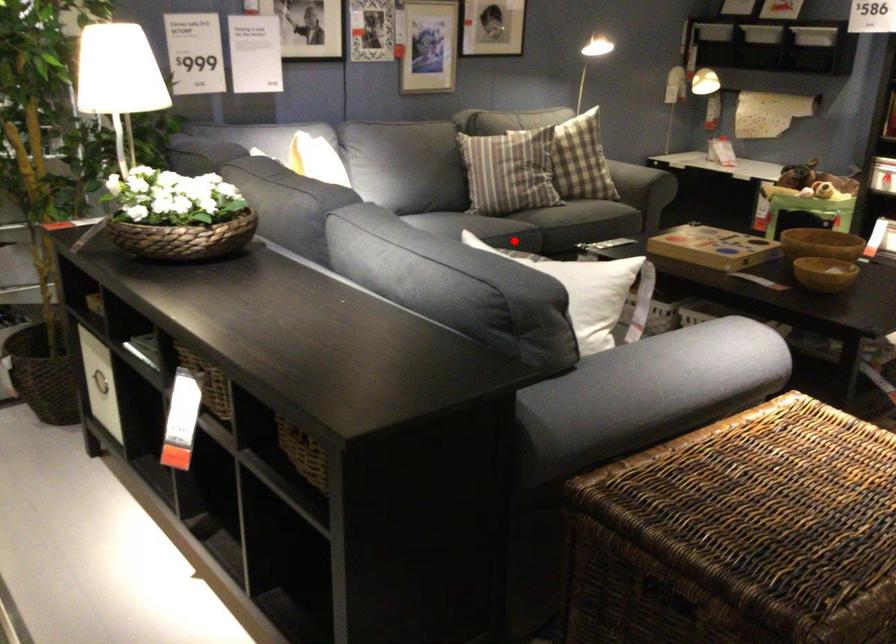
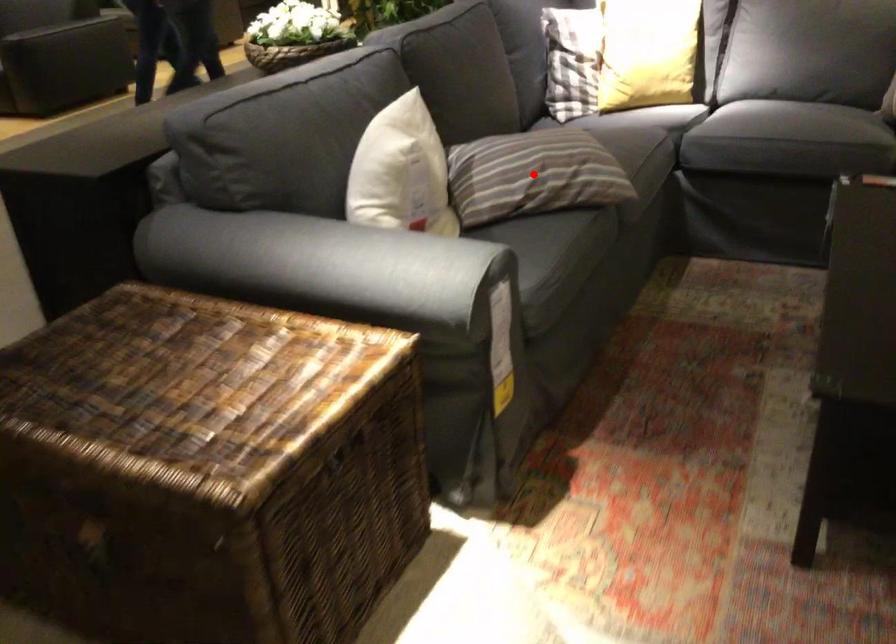
I am providing you with two images of the same scene from different viewpoints. A red point is marked on the first image and another point is marked on the second image. Is the marked point in image1 the same physical position as the marked point in image2?

No